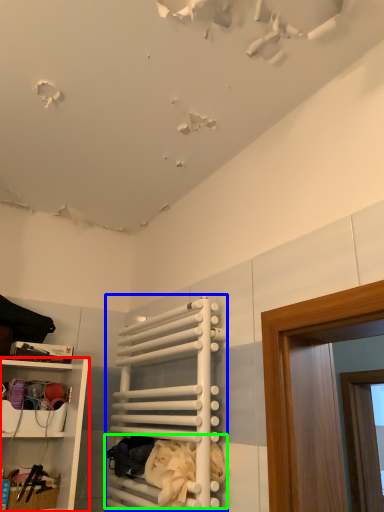
Question: Which object is the closest to the shelf (highlighted by a red box)? Choose among these: cabinet (highlighted by a blue box) or laundry (highlighted by a green box).

Choices:
 (A) cabinet
 (B) laundry

Answer: (A)